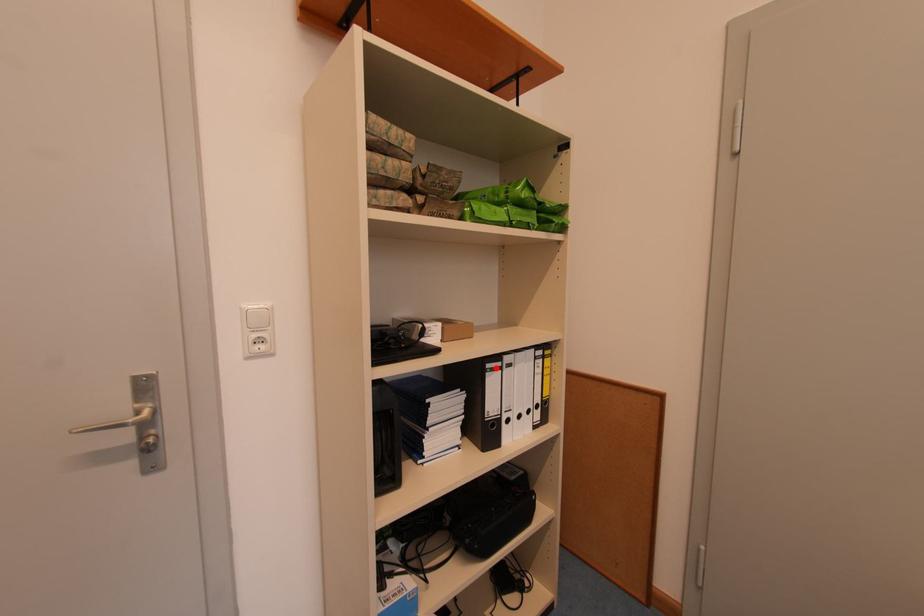
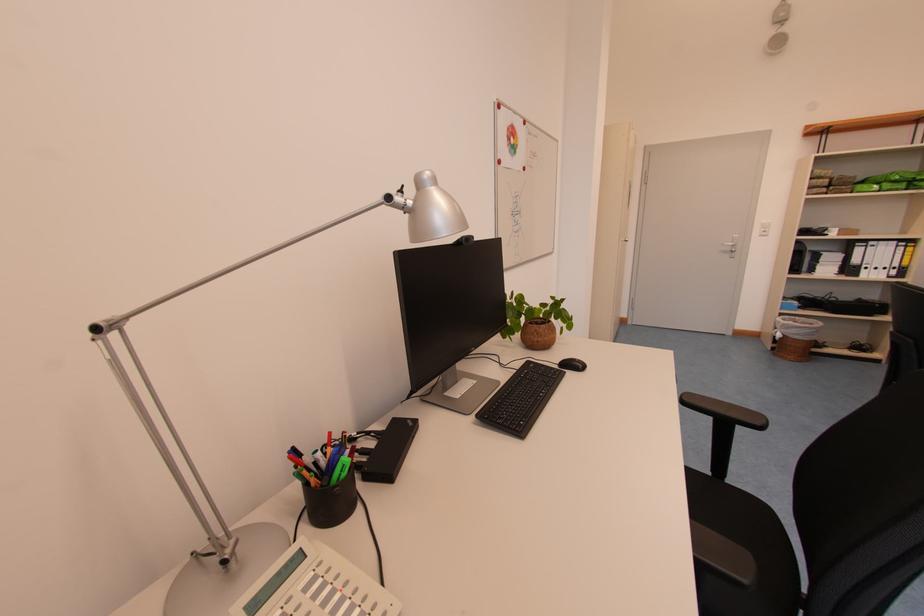
The point at the highlighted location is marked in the first image. Where is the corresponding point in the second image?

(865, 246)